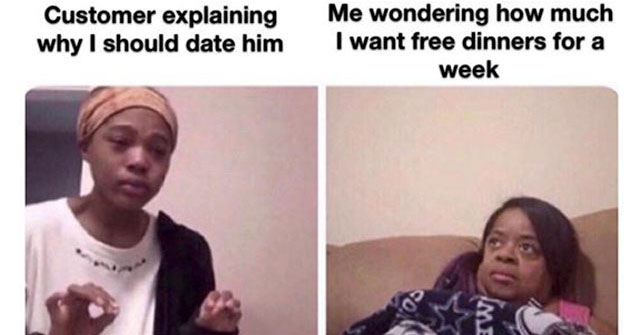
Where is `border between two pictures`? border between two pictures is located at coordinates (319, 199).